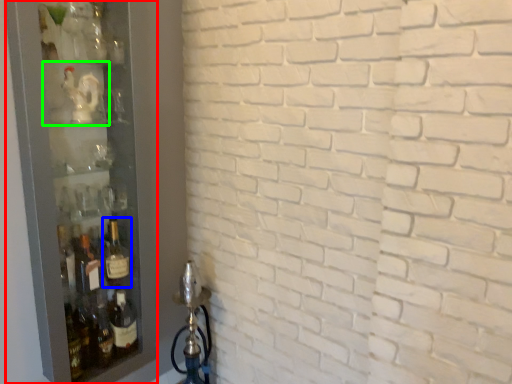
Question: Estimate the real-world distances between objects in this image. Which object is closer to glass door (highlighted by a red box), bottle (highlighted by a blue box) or shelf (highlighted by a green box)?

Choices:
 (A) bottle
 (B) shelf

Answer: (B)